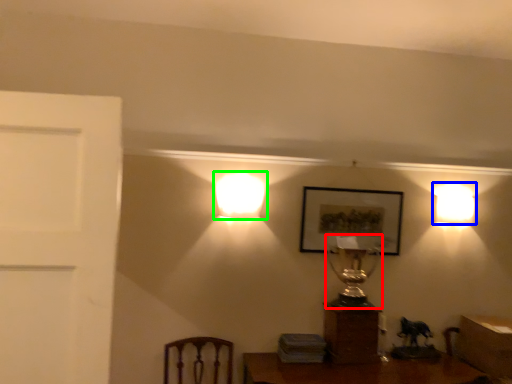
Question: Estimate the real-world distances between objects in this image. Which object is closer to table lamp (highlighted by a red box), lamp (highlighted by a blue box) or lamp (highlighted by a green box)?

Choices:
 (A) lamp
 (B) lamp

Answer: (A)